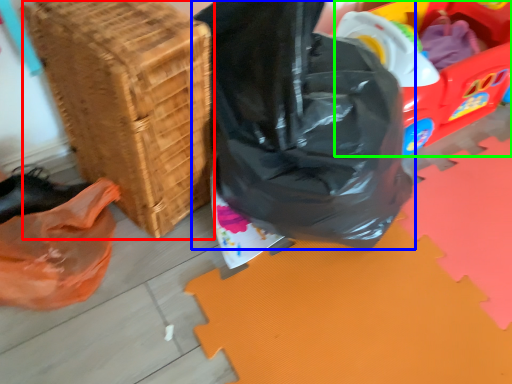
Question: Which object is positioned closest to basket (highlighted by a red box)? Select from plastic bag (highlighted by a blue box) and wagon (highlighted by a green box).

Choices:
 (A) plastic bag
 (B) wagon

Answer: (A)